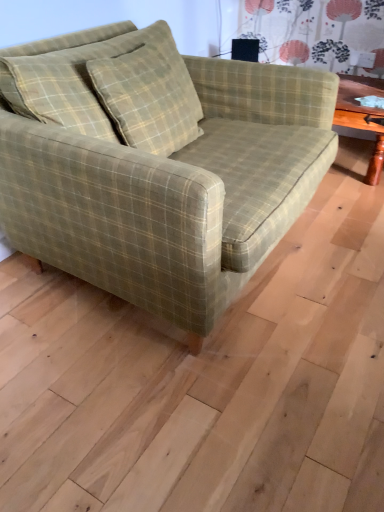
The image size is (384, 512). Identify the location of green plaid pillow at center. (110, 89).

What is the approximate width of green plaid pillow at center?

10.42 inches.

Describe the element at coordinates (110, 89) in the screenshot. I see `green plaid pillow at center` at that location.

Image resolution: width=384 pixels, height=512 pixels. In order to click on green plaid fabric couch at center in this screenshot , I will do `click(158, 172)`.

The image size is (384, 512). Describe the element at coordinates (158, 172) in the screenshot. I see `green plaid fabric couch at center` at that location.

Where is `green plaid pillow at center`? green plaid pillow at center is located at coordinates (110, 89).

Which is more to the left, green plaid fabric couch at center or green plaid pillow at center?

Positioned to the left is green plaid pillow at center.

In the scene shown: Does green plaid fabric couch at center come behind green plaid pillow at center?

No, the depth of green plaid fabric couch at center is less than that of green plaid pillow at center.

Based on the photo, which is farther, [261,253] or [114,27]?

The point [114,27] is farther from the camera.

From the image's perspective, would you say green plaid fabric couch at center is positioned over green plaid pillow at center?

No.

From a real-world perspective, is green plaid fabric couch at center positioned above or below green plaid pillow at center?

From a real-world perspective, green plaid fabric couch at center is physically below green plaid pillow at center.

In terms of width, does green plaid fabric couch at center look wider or thinner when compared to green plaid pillow at center?

Considering their sizes, green plaid fabric couch at center looks broader than green plaid pillow at center.

Which of these two, green plaid fabric couch at center or green plaid pillow at center, stands taller?

Standing taller between the two is green plaid fabric couch at center.

Based on the photo, does green plaid fabric couch at center have a smaller size compared to green plaid pillow at center?

No, green plaid fabric couch at center is not smaller than green plaid pillow at center.

Is green plaid pillow at center surrounded by green plaid fabric couch at center?

Indeed, green plaid pillow at center is located within green plaid fabric couch at center.

Is green plaid fabric couch at center not close to green plaid pillow at center?

No, green plaid fabric couch at center is not far from green plaid pillow at center.

Could you tell me if green plaid fabric couch at center is turned towards green plaid pillow at center?

Yes, green plaid fabric couch at center is oriented towards green plaid pillow at center.

What's the angular difference between green plaid fabric couch at center and green plaid pillow at center's facing directions?

The angular difference between green plaid fabric couch at center and green plaid pillow at center is 4.15 degrees.

The width and height of the screenshot is (384, 512). In order to click on studio couch below the green plaid pillow at center (from a real-world perspective) in this screenshot , I will do `click(158, 172)`.

Which is more to the left, green plaid pillow at center or green plaid fabric couch at center?

Positioned to the left is green plaid pillow at center.

Which object is more forward, green plaid pillow at center or green plaid fabric couch at center?

green plaid fabric couch at center is in front.

Is point (168, 122) positioned behind point (272, 193)?

Yes, it is.

From the image's perspective, between green plaid pillow at center and green plaid fabric couch at center, who is located below?

green plaid fabric couch at center, from the image's perspective.

From a real-world perspective, does green plaid pillow at center sit lower than green plaid fabric couch at center?

No, from a real-world perspective, green plaid pillow at center is not below green plaid fabric couch at center.

Is green plaid pillow at center wider or thinner than green plaid fabric couch at center?

green plaid pillow at center is thinner than green plaid fabric couch at center.

Considering the relative sizes of green plaid pillow at center and green plaid fabric couch at center in the image provided, is green plaid pillow at center shorter than green plaid fabric couch at center?

Yes.

Considering the sizes of objects green plaid pillow at center and green plaid fabric couch at center in the image provided, who is bigger, green plaid pillow at center or green plaid fabric couch at center?

green plaid fabric couch at center.

Do you think green plaid pillow at center is within green plaid fabric couch at center, or outside of it?

green plaid pillow at center lies within the bounds of green plaid fabric couch at center.

Are green plaid pillow at center and green plaid fabric couch at center located far from each other?

Actually, green plaid pillow at center and green plaid fabric couch at center are a little close together.

Is green plaid pillow at center oriented towards green plaid fabric couch at center?

Yes, green plaid pillow at center faces towards green plaid fabric couch at center.

Measure the distance between green plaid pillow at center and green plaid fabric couch at center.

6.69 inches.

At what (x,y) coordinates should I click in order to perform the action: click on studio couch below the green plaid pillow at center (from a real-world perspective). Please return your answer as a coordinate pair (x, y). Image resolution: width=384 pixels, height=512 pixels. Looking at the image, I should click on (158, 172).

You are a GUI agent. You are given a task and a screenshot of the screen. Output one action in this format:
    pyautogui.click(x=<x>, y=<y>)
    Task: Click on the studio couch that appears in front of the green plaid pillow at center
    This screenshot has height=512, width=384.
    Given the screenshot: What is the action you would take?
    pyautogui.click(x=158, y=172)

Where is `pillow lying behind the green plaid fabric couch at center`? The height and width of the screenshot is (512, 384). pillow lying behind the green plaid fabric couch at center is located at coordinates (110, 89).